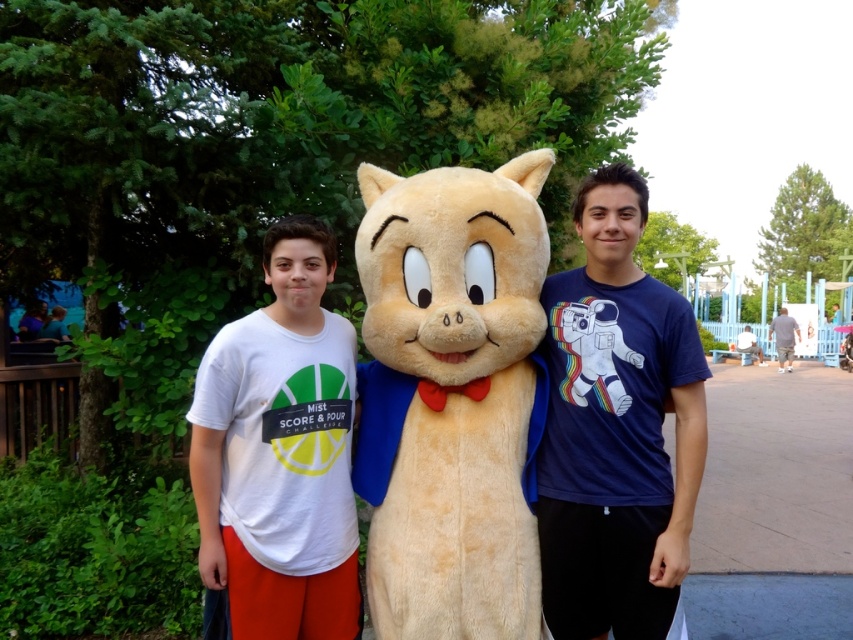
Who is higher up, navy blue t-shirt at center or gray cotton shirt at right?

navy blue t-shirt at center is above.

Is point (543, 490) farther from camera compared to point (779, 340)?

No, it is not.

Locate an element on the screen. Image resolution: width=853 pixels, height=640 pixels. navy blue t-shirt at center is located at coordinates (616, 428).

Can you confirm if white cotton t-shirt at center is positioned to the left of gray cotton shirt at right?

Indeed, white cotton t-shirt at center is positioned on the left side of gray cotton shirt at right.

Measure the distance between white cotton t-shirt at center and camera.

6.83 feet

Where is `white cotton t-shirt at center`? white cotton t-shirt at center is located at coordinates 277,456.

Between point (788, 344) and point (741, 332), which one is positioned behind?

Positioned behind is point (741, 332).

Between gray cotton shirt at right and light blue t-shirt at center, which one is positioned higher?

gray cotton shirt at right

Locate an element on the screen. gray cotton shirt at right is located at coordinates (784, 337).